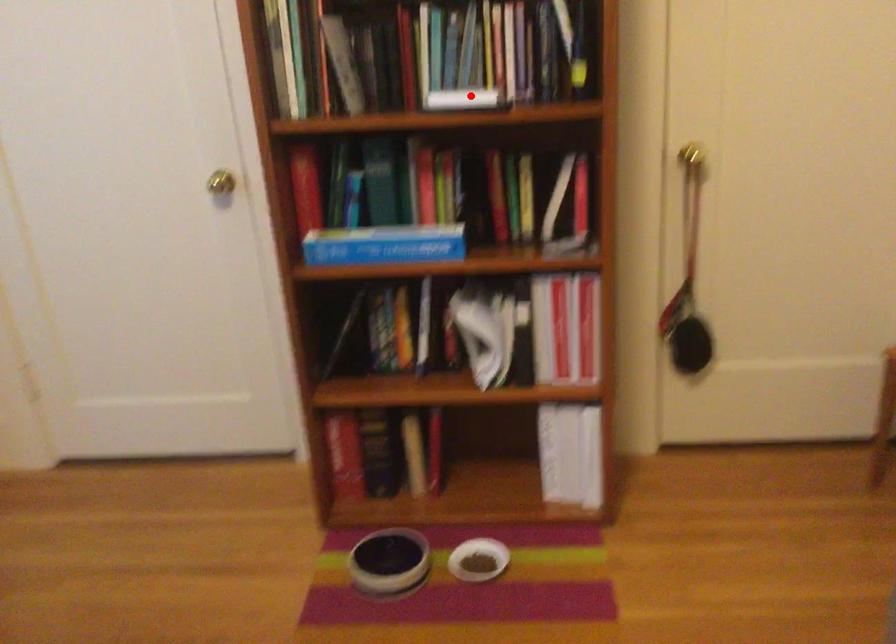
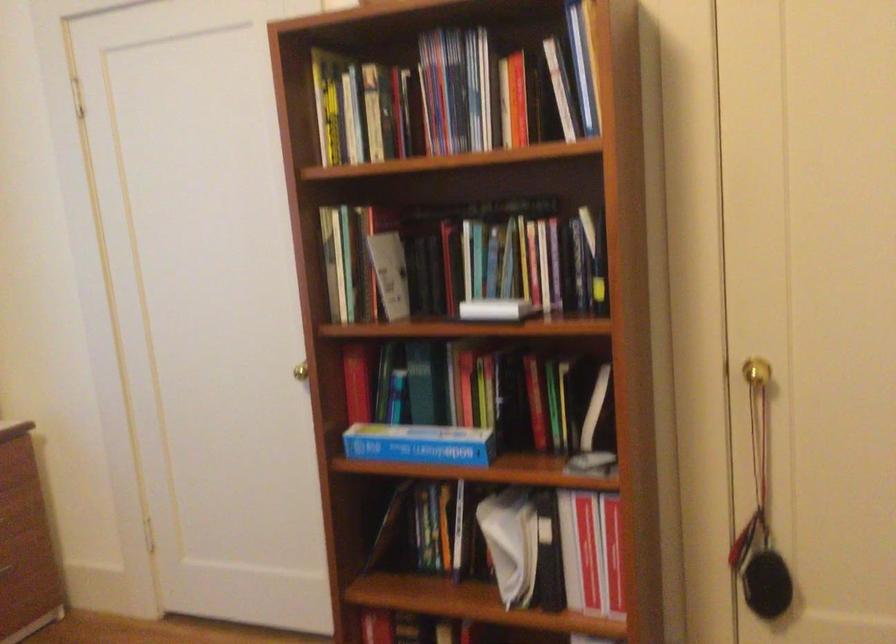
Question: I am providing you with two images of the same scene from different viewpoints. A red point is marked on the first image. Is the red point's position out of view in image 2?

Choices:
 (A) Yes
 (B) No

Answer: (B)